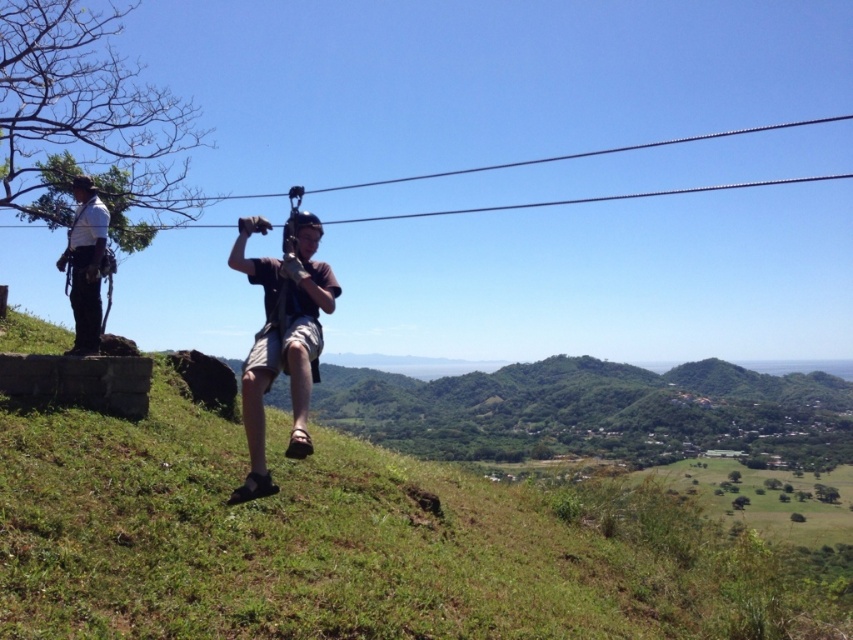
Question: Is brown fabric shorts at center to the right of white shirt with harness at left from the viewer's perspective?

Choices:
 (A) yes
 (B) no

Answer: (A)

Question: Which point is farther to the camera?

Choices:
 (A) (297, 413)
 (B) (4, 332)
 (C) (79, 276)

Answer: (B)

Question: Among these objects, which one is nearest to the camera?

Choices:
 (A) brown fabric shorts at center
 (B) white shirt with harness at left
 (C) green grassy hillside at center

Answer: (C)

Question: Is green grassy hillside at center positioned at the back of white shirt with harness at left?

Choices:
 (A) no
 (B) yes

Answer: (A)

Question: Which of the following is the closest to the observer?

Choices:
 (A) green grassy hillside at center
 (B) white shirt with harness at left

Answer: (A)

Question: Can you confirm if brown fabric shorts at center is positioned below white shirt with harness at left?

Choices:
 (A) no
 (B) yes

Answer: (B)